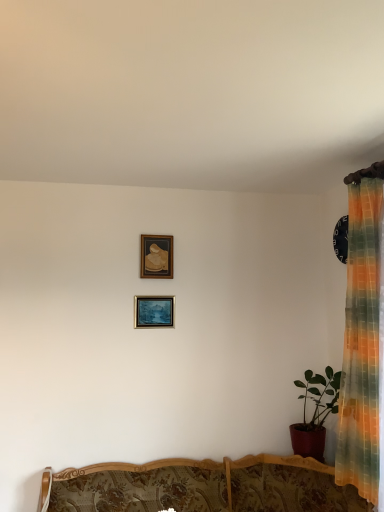
Question: Is point (329, 388) positioned closer to the camera than point (163, 297)?

Choices:
 (A) farther
 (B) closer

Answer: (B)

Question: Looking at the image, does matte red pot at right seem bigger or smaller compared to matte wooden picture frame at center, the 1th picture frame from the bottom?

Choices:
 (A) big
 (B) small

Answer: (A)

Question: Which object is positioned closest to the matte red pot at right?

Choices:
 (A) wooden picture frame at upper center, arranged as the 2th picture frame when ordered from the bottom
 (B) matte wooden picture frame at center, the 1th picture frame from the bottom
 (C) wooden floral-patterned sofa at center

Answer: (C)

Question: Which is farther from the wooden floral-patterned sofa at center?

Choices:
 (A) matte wooden picture frame at center, the 1th picture frame from the bottom
 (B) matte red pot at right
 (C) wooden picture frame at upper center, arranged as the first picture frame when viewed from the top

Answer: (C)